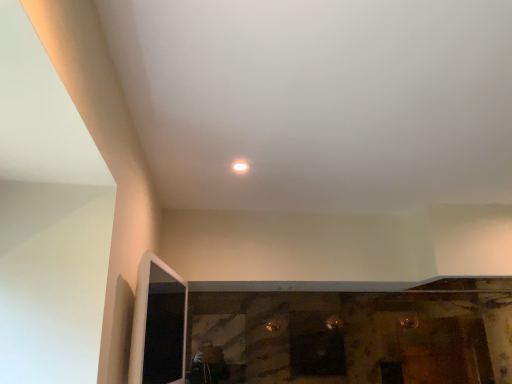
Question: From the image's perspective, is transparent glass screen door at lower left above or below white glossy light at center?

Choices:
 (A) below
 (B) above

Answer: (A)

Question: Considering the positions of transparent glass screen door at lower left and white glossy light at center in the image, is transparent glass screen door at lower left wider or thinner than white glossy light at center?

Choices:
 (A) wide
 (B) thin

Answer: (B)

Question: Do you think transparent glass screen door at lower left is within white glossy light at center, or outside of it?

Choices:
 (A) outside
 (B) inside

Answer: (A)

Question: From their relative heights in the image, would you say white glossy light at center is taller or shorter than transparent glass screen door at lower left?

Choices:
 (A) tall
 (B) short

Answer: (B)

Question: Considering the positions of white glossy light at center and transparent glass screen door at lower left in the image, is white glossy light at center bigger or smaller than transparent glass screen door at lower left?

Choices:
 (A) big
 (B) small

Answer: (B)

Question: Is white glossy light at center to the left or to the right of transparent glass screen door at lower left in the image?

Choices:
 (A) left
 (B) right

Answer: (B)

Question: In the image, is white glossy light at center positioned in front of or behind transparent glass screen door at lower left?

Choices:
 (A) front
 (B) behind

Answer: (B)